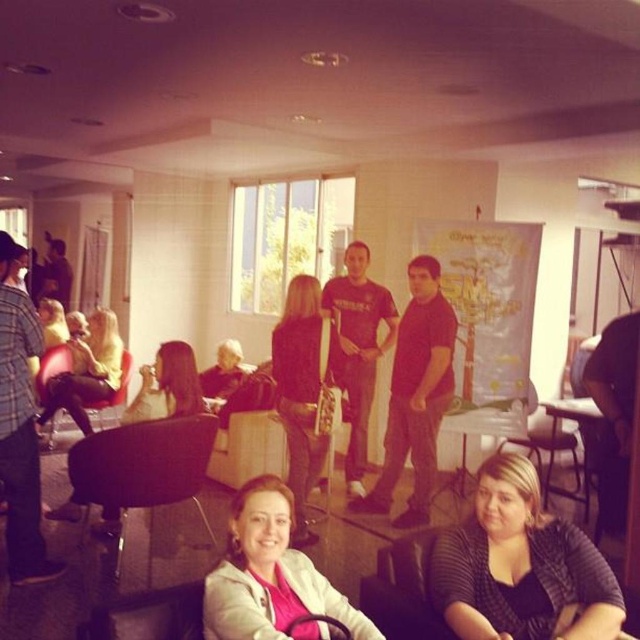
You are a hairstylist at the event and need to use the matte black hairdryer at left on the smooth brown hair at center. Can you reach the hairdryer from where you are standing without moving more than 6 feet?

The matte black hairdryer at left is 5.95 feet from the smooth brown hair at center, so yes, you can reach the hairdryer from where you are standing without moving more than 6 feet.

You are a delivery person who needs to place a 5 foot long package between the black leather jacket at center and the matte black hairdryer at center. Can you fit it there?

The distance between the black leather jacket at center and the matte black hairdryer at center is 5.01 feet. Since the package is 5 feet long, it will fit with a small amount of space remaining.